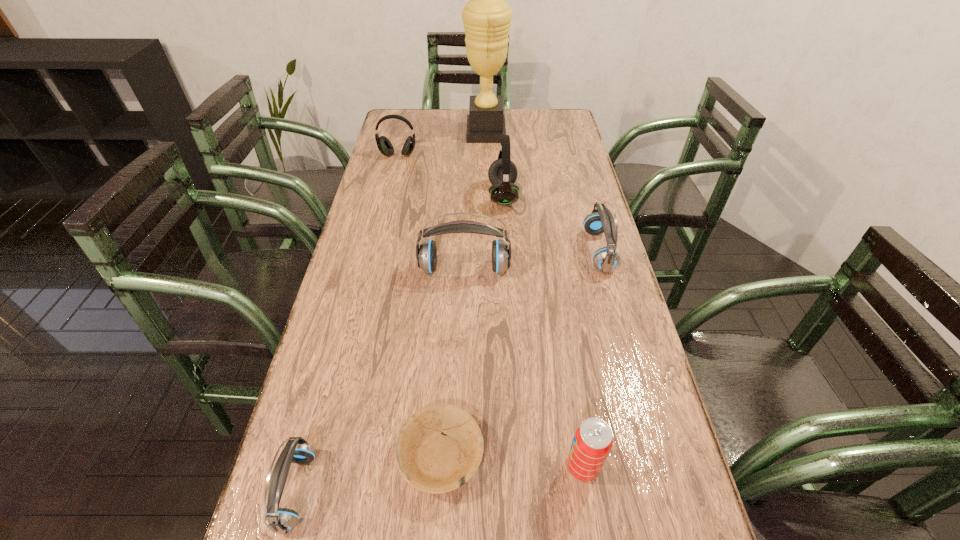
Locate an element on the screen. The width and height of the screenshot is (960, 540). free point located on the ear cups of the left black headset is located at coordinates point(384,211).

Where is `free space located on the back of the soda can`? The height and width of the screenshot is (540, 960). free space located on the back of the soda can is located at coordinates (574, 417).

You are a GUI agent. You are given a task and a screenshot of the screen. Output one action in this format:
    pyautogui.click(x=<x>, y=<y>)
    Task: Click on the free spot located on the ear cups of the rightmost object
    This screenshot has width=960, height=540.
    Given the screenshot: What is the action you would take?
    pyautogui.click(x=492, y=251)

The image size is (960, 540). Find the location of `vacant area situated 0.300m on the ear cups of the rightmost object`. vacant area situated 0.300m on the ear cups of the rightmost object is located at coordinates (481, 251).

You are a GUI agent. You are given a task and a screenshot of the screen. Output one action in this format:
    pyautogui.click(x=<x>, y=<y>)
    Task: Click on the vacant area situated 0.270m on the ear cups of the rightmost object
    This screenshot has height=540, width=960.
    Given the screenshot: What is the action you would take?
    pyautogui.click(x=492, y=251)

Locate an element on the screen. vacant space situated on the ear cups of the shortest headset is located at coordinates (381, 490).

You are a GUI agent. You are given a task and a screenshot of the screen. Output one action in this format:
    pyautogui.click(x=<x>, y=<y>)
    Task: Click on the blank area located on the right of the bowl
    
    Given the screenshot: What is the action you would take?
    pyautogui.click(x=519, y=456)

Locate an element on the screen. Image resolution: width=960 pixels, height=540 pixels. object at the far edge is located at coordinates (486, 17).

Where is `soda can located at the right edge`? The height and width of the screenshot is (540, 960). soda can located at the right edge is located at coordinates (593, 440).

Image resolution: width=960 pixels, height=540 pixels. What are the coordinates of `headset that is positioned at the right edge` in the screenshot? It's located at (601, 220).